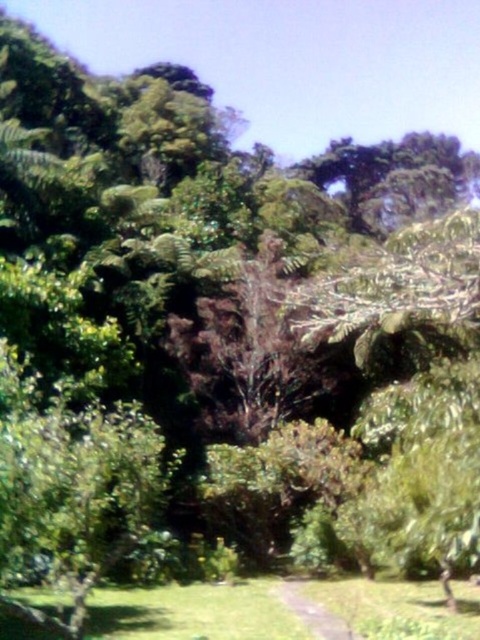
Does green grass at lower center have a lesser width compared to green grassy path at center?

In fact, green grass at lower center might be wider than green grassy path at center.

Which is more to the left, green grass at lower center or green grassy path at center?

From the viewer's perspective, green grass at lower center appears more on the left side.

Between point (476, 600) and point (336, 620), which one is positioned in front?

Point (336, 620)

You are a GUI agent. You are given a task and a screenshot of the screen. Output one action in this format:
    pyautogui.click(x=<x>, y=<y>)
    Task: Click on the green grass at lower center
    The image size is (480, 640).
    Given the screenshot: What is the action you would take?
    pyautogui.click(x=194, y=612)